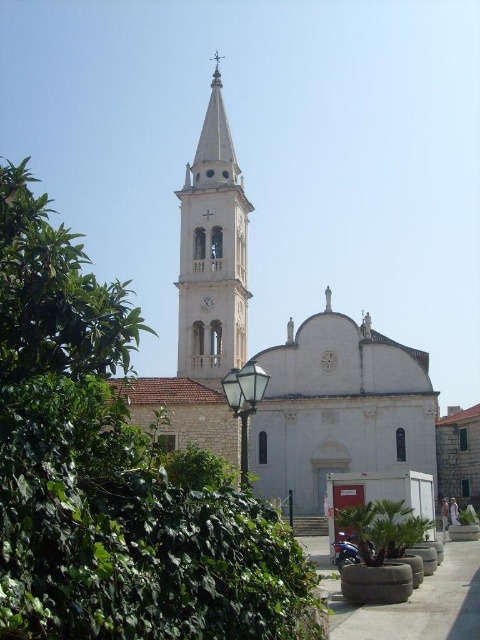
You are a tourist visiting the church and want to take a photo that includes both the white stone church at center and the white stone bell tower at center. Which one should you focus on to ensure both are in frame?

You should focus on the white stone church at center because it is bigger than the white stone bell tower at center, so it will be easier to include both in the frame by centering the church and adjusting the zoom accordingly.

You are standing on the sidewalk in front of the church and notice the green leafy tree at left and the white stone bell tower at center. Which object appears wider from your perspective?

The green leafy tree at left appears wider than the white stone bell tower at center from your perspective because its width is larger than the bell tower.

You are standing in front of the church and notice two points marked in the image. The first point is at coordinate point(48, 227) and the second at point(197, 208). Which point is nearer to your current position?

Point(48, 227) is closer to the camera than point(197, 208), so the first point is nearer to your current position.